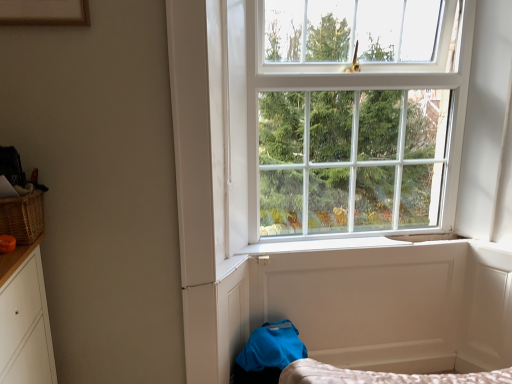
Question: Does woven brown basket at left have a larger size compared to white wooden window at upper center?

Choices:
 (A) no
 (B) yes

Answer: (A)

Question: From the image's perspective, does woven brown basket at left appear lower than white wooden window at upper center?

Choices:
 (A) yes
 (B) no

Answer: (A)

Question: Is woven brown basket at left thinner than white wooden window at upper center?

Choices:
 (A) no
 (B) yes

Answer: (B)

Question: Is woven brown basket at left oriented away from white wooden window at upper center?

Choices:
 (A) no
 (B) yes

Answer: (A)

Question: Could you tell me if woven brown basket at left is facing white wooden window at upper center?

Choices:
 (A) no
 (B) yes

Answer: (A)

Question: Considering the relative positions of wooden picture frame at upper left and white smooth window sill at center in the image provided, is wooden picture frame at upper left to the left or to the right of white smooth window sill at center?

Choices:
 (A) left
 (B) right

Answer: (A)

Question: Do you think wooden picture frame at upper left is within white smooth window sill at center, or outside of it?

Choices:
 (A) inside
 (B) outside

Answer: (B)

Question: Is wooden picture frame at upper left in front of or behind white smooth window sill at center in the image?

Choices:
 (A) front
 (B) behind

Answer: (A)

Question: Is point (80, 11) positioned closer to the camera than point (362, 246)?

Choices:
 (A) farther
 (B) closer

Answer: (B)

Question: From the image's perspective, is white wooden window at upper center above or below woven brown basket at left?

Choices:
 (A) above
 (B) below

Answer: (A)

Question: Considering the positions of white wooden window at upper center and woven brown basket at left in the image, is white wooden window at upper center wider or thinner than woven brown basket at left?

Choices:
 (A) thin
 (B) wide

Answer: (B)

Question: From a real-world perspective, is white wooden window at upper center physically located above or below woven brown basket at left?

Choices:
 (A) below
 (B) above

Answer: (B)

Question: Is white wooden window at upper center taller or shorter than woven brown basket at left?

Choices:
 (A) tall
 (B) short

Answer: (A)

Question: From a real-world perspective, relative to white smooth window sill at center, is woven brown basket at left vertically above or below?

Choices:
 (A) below
 (B) above

Answer: (B)

Question: Considering the positions of point (10, 210) and point (367, 238), is point (10, 210) closer or farther from the camera than point (367, 238)?

Choices:
 (A) farther
 (B) closer

Answer: (B)